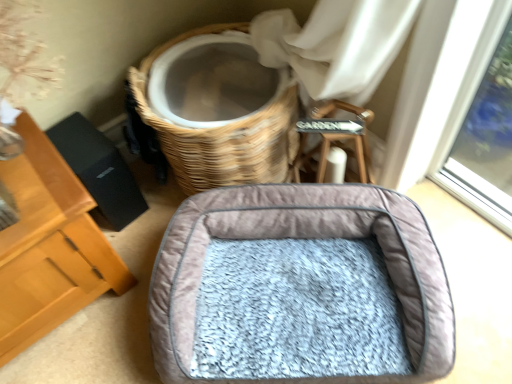
What do you see at coordinates (223, 135) in the screenshot? I see `woven wood basket at upper center` at bounding box center [223, 135].

Where is `woven wood basket at upper center`? Image resolution: width=512 pixels, height=384 pixels. woven wood basket at upper center is located at coordinates (223, 135).

The image size is (512, 384). What do you see at coordinates (300, 288) in the screenshot?
I see `gray plush dog bed at center` at bounding box center [300, 288].

Where is `gray plush dog bed at center`? Image resolution: width=512 pixels, height=384 pixels. gray plush dog bed at center is located at coordinates (300, 288).

What is the approximate height of gray plush dog bed at center?

The height of gray plush dog bed at center is 9.34 inches.

The image size is (512, 384). Identify the location of woven wood basket at upper center. (223, 135).

Is woven wood basket at upper center to the left of gray plush dog bed at center from the viewer's perspective?

Correct, you'll find woven wood basket at upper center to the left of gray plush dog bed at center.

Who is more distant, woven wood basket at upper center or gray plush dog bed at center?

woven wood basket at upper center is further away from the camera.

In the scene shown: Which is closer to the camera, (288, 143) or (377, 309)?

Clearly, point (288, 143) is more distant from the camera than point (377, 309).

From the image's perspective, is woven wood basket at upper center above gray plush dog bed at center?

Yes, from the image's perspective, woven wood basket at upper center is over gray plush dog bed at center.

From a real-world perspective, who is located higher, woven wood basket at upper center or gray plush dog bed at center?

From a 3D spatial view, woven wood basket at upper center is above.

Considering the relative sizes of woven wood basket at upper center and gray plush dog bed at center in the image provided, is woven wood basket at upper center wider than gray plush dog bed at center?

Incorrect, the width of woven wood basket at upper center does not surpass that of gray plush dog bed at center.

From the picture: Between woven wood basket at upper center and gray plush dog bed at center, which one has more height?

With more height is woven wood basket at upper center.

From the picture: Considering the sizes of woven wood basket at upper center and gray plush dog bed at center in the image, is woven wood basket at upper center bigger or smaller than gray plush dog bed at center?

In the image, woven wood basket at upper center appears to be larger than gray plush dog bed at center.

Would you say woven wood basket at upper center is outside gray plush dog bed at center?

Absolutely, woven wood basket at upper center is external to gray plush dog bed at center.

Would you consider woven wood basket at upper center to be distant from gray plush dog bed at center?

Actually, woven wood basket at upper center and gray plush dog bed at center are a little close together.

Does woven wood basket at upper center turn towards gray plush dog bed at center?

Yes, woven wood basket at upper center faces towards gray plush dog bed at center.

How many degrees apart are the facing directions of woven wood basket at upper center and gray plush dog bed at center?

6.11 degrees separate the facing orientations of woven wood basket at upper center and gray plush dog bed at center.

Consider the image. Measure the distance between woven wood basket at upper center and gray plush dog bed at center.

A distance of 12.27 inches exists between woven wood basket at upper center and gray plush dog bed at center.

I want to click on dog bed below the woven wood basket at upper center (from the image's perspective), so click(300, 288).

Which is more to the right, gray plush dog bed at center or woven wood basket at upper center?

Positioned to the right is gray plush dog bed at center.

Which object is more forward, gray plush dog bed at center or woven wood basket at upper center?

gray plush dog bed at center is closer to the camera.

Is point (297, 251) closer to camera compared to point (212, 151)?

No, (297, 251) is further to viewer.

From the image's perspective, is gray plush dog bed at center on top of woven wood basket at upper center?

No, from the image's perspective, gray plush dog bed at center is not above woven wood basket at upper center.

From a real-world perspective, which is physically above, gray plush dog bed at center or woven wood basket at upper center?

In real-world perspective, woven wood basket at upper center is above.

Considering the sizes of objects gray plush dog bed at center and woven wood basket at upper center in the image provided, who is thinner, gray plush dog bed at center or woven wood basket at upper center?

With smaller width is woven wood basket at upper center.

Does gray plush dog bed at center have a greater height compared to woven wood basket at upper center?

Incorrect, the height of gray plush dog bed at center is not larger of that of woven wood basket at upper center.

From the picture: Can you confirm if gray plush dog bed at center is smaller than woven wood basket at upper center?

Indeed, gray plush dog bed at center has a smaller size compared to woven wood basket at upper center.

Which is correct: gray plush dog bed at center is inside woven wood basket at upper center, or outside of it?

gray plush dog bed at center is not enclosed by woven wood basket at upper center.

Would you consider gray plush dog bed at center to be distant from woven wood basket at upper center?

No, there isn't a large distance between gray plush dog bed at center and woven wood basket at upper center.

Could you tell me if gray plush dog bed at center is turned towards woven wood basket at upper center?

No, gray plush dog bed at center is not facing towards woven wood basket at upper center.

How different are the orientations of gray plush dog bed at center and woven wood basket at upper center in degrees?

The angular difference between gray plush dog bed at center and woven wood basket at upper center is 6.11 degrees.

The height and width of the screenshot is (384, 512). Identify the location of dog bed in front of the woven wood basket at upper center. (300, 288).

At what (x,y) coordinates should I click in order to perform the action: click on dog bed that is on the right side of woven wood basket at upper center. Please return your answer as a coordinate pair (x, y). The image size is (512, 384). Looking at the image, I should click on (300, 288).

Where is `basket behind the gray plush dog bed at center`? The height and width of the screenshot is (384, 512). basket behind the gray plush dog bed at center is located at coordinates (223, 135).